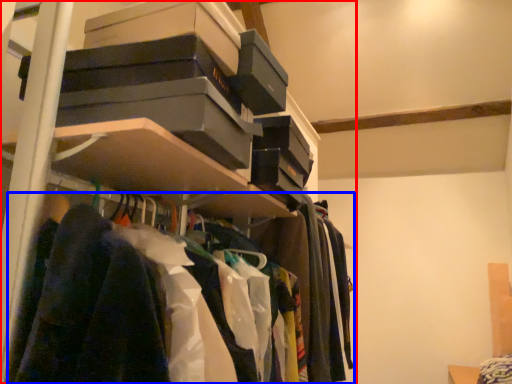
Question: Which of the following is the farthest to the observer, shelf (highlighted by a red box) or clothing (highlighted by a blue box)?

Choices:
 (A) shelf
 (B) clothing

Answer: (A)